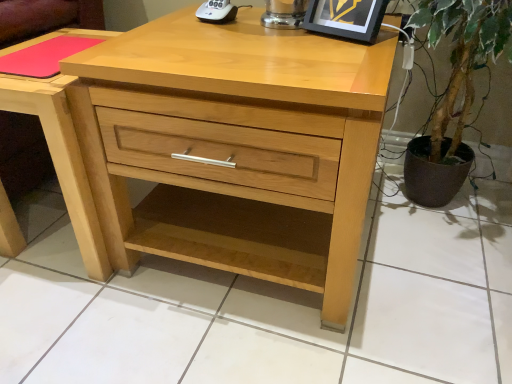
At what (x,y) coordinates should I click in order to perform the action: click on free space in front of light wood nightstand at center. Please return your answer as a coordinate pair (x, y). The width and height of the screenshot is (512, 384). Looking at the image, I should click on (82, 317).